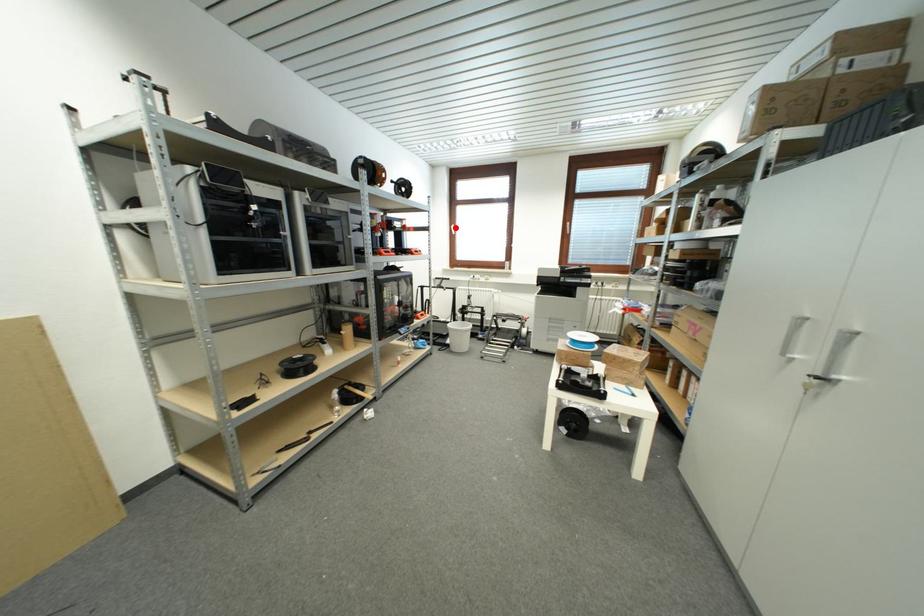
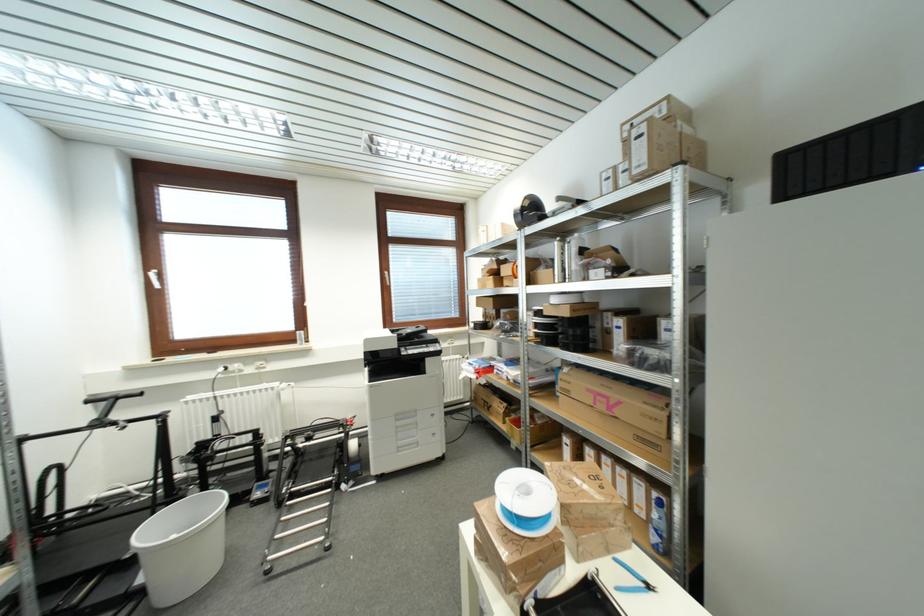
Question: I am providing you with two images of the same scene from different viewpoints. In image1, a red point is highlighted. Considering the same 3D point in image2, which of the following is correct?

Choices:
 (A) It is closer
 (B) It is farther

Answer: (B)